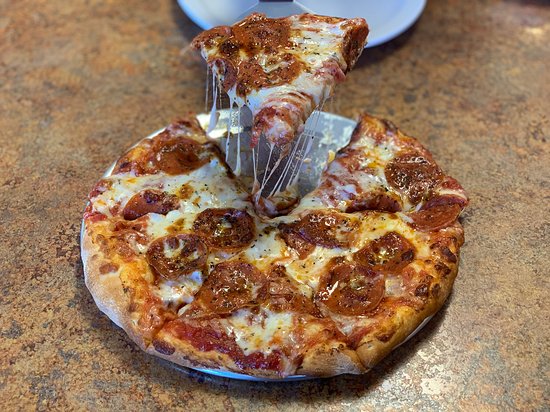
In order to click on table behind pizza in this screenshot , I will do `click(351, 96)`.